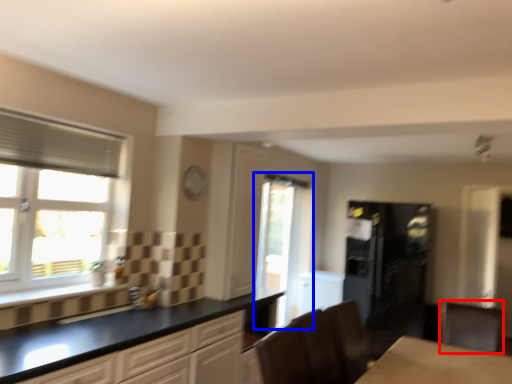
Question: Among these objects, which one is farthest to the camera, cabinetry (highlighted by a red box) or window (highlighted by a blue box)?

Choices:
 (A) cabinetry
 (B) window

Answer: (B)